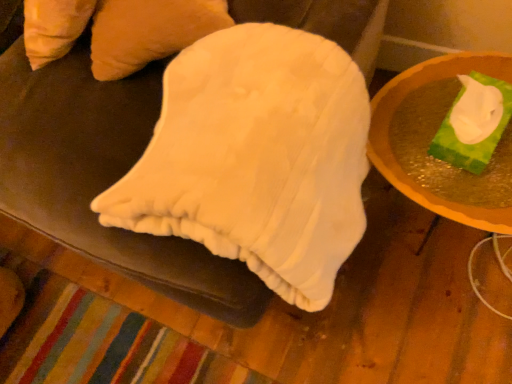
You are a GUI agent. You are given a task and a screenshot of the screen. Output one action in this format:
    pyautogui.click(x=<x>, y=<y>)
    Task: Click on the green matte tissue box at right
    This screenshot has height=384, width=512.
    Given the screenshot: What is the action you would take?
    pyautogui.click(x=394, y=112)

This screenshot has height=384, width=512. What do you see at coordinates (394, 112) in the screenshot?
I see `green matte tissue box at right` at bounding box center [394, 112].

Describe the element at coordinates (102, 177) in the screenshot. This screenshot has height=384, width=512. I see `matte white tissue box at right` at that location.

I want to click on matte white tissue box at right, so click(102, 177).

Locate an element on the screen. The height and width of the screenshot is (384, 512). green matte tissue box at right is located at coordinates [x=394, y=112].

Between matte white tissue box at right and green matte tissue box at right, which one appears on the right side from the viewer's perspective?

green matte tissue box at right is more to the right.

Is matte white tissue box at right further to camera compared to green matte tissue box at right?

That is False.

Which is behind, point (187, 304) or point (462, 220)?

Positioned behind is point (462, 220).

From the image's perspective, which one is positioned lower, matte white tissue box at right or green matte tissue box at right?

green matte tissue box at right.

From a real-world perspective, is matte white tissue box at right physically located above or below green matte tissue box at right?

From a real-world perspective, matte white tissue box at right is physically below green matte tissue box at right.

Which object is thinner, matte white tissue box at right or green matte tissue box at right?

Thinner between the two is green matte tissue box at right.

Between matte white tissue box at right and green matte tissue box at right, which one has less height?

Standing shorter between the two is green matte tissue box at right.

In the scene shown: Who is bigger, matte white tissue box at right or green matte tissue box at right?

matte white tissue box at right is bigger.

Is matte white tissue box at right inside or outside of green matte tissue box at right?

matte white tissue box at right is spatially situated outside green matte tissue box at right.

Does matte white tissue box at right touch green matte tissue box at right?

No, matte white tissue box at right is not next to green matte tissue box at right.

Is matte white tissue box at right looking in the opposite direction of green matte tissue box at right?

No, matte white tissue box at right is not facing the opposite direction of green matte tissue box at right.

How different are the orientations of matte white tissue box at right and green matte tissue box at right in degrees?

They differ by 4.82 degrees in their facing directions.

Where is `furniture that appears in front of the green matte tissue box at right`? furniture that appears in front of the green matte tissue box at right is located at coordinates (102, 177).

Which object is positioned more to the right, green matte tissue box at right or matte white tissue box at right?

From the viewer's perspective, green matte tissue box at right appears more on the right side.

Which object is further away from the camera taking this photo, green matte tissue box at right or matte white tissue box at right?

green matte tissue box at right is further away from the camera.

Which is more distant, (376, 123) or (32, 213)?

Positioned behind is point (376, 123).

From the image's perspective, does green matte tissue box at right appear lower than matte white tissue box at right?

Yes.

From a real-world perspective, is green matte tissue box at right on top of matte white tissue box at right?

Indeed, from a real-world perspective, green matte tissue box at right stands above matte white tissue box at right.

Which object is wider, green matte tissue box at right or matte white tissue box at right?

With larger width is matte white tissue box at right.

Considering the sizes of objects green matte tissue box at right and matte white tissue box at right in the image provided, who is taller, green matte tissue box at right or matte white tissue box at right?

matte white tissue box at right.

Can you confirm if green matte tissue box at right is bigger than matte white tissue box at right?

Actually, green matte tissue box at right might be smaller than matte white tissue box at right.

Is green matte tissue box at right located outside matte white tissue box at right?

Yes, green matte tissue box at right is located beyond the bounds of matte white tissue box at right.

In the scene shown: Can you see green matte tissue box at right touching matte white tissue box at right?

No.

Is green matte tissue box at right positioned with its back to matte white tissue box at right?

green matte tissue box at right is not turned away from matte white tissue box at right.

This screenshot has height=384, width=512. What are the coordinates of `furniture in front of the green matte tissue box at right` in the screenshot? It's located at coord(102,177).

Image resolution: width=512 pixels, height=384 pixels. In order to click on furniture below the green matte tissue box at right (from a real-world perspective) in this screenshot , I will do `click(102, 177)`.

Where is `furniture that appears above the green matte tissue box at right (from the image's perspective)`? furniture that appears above the green matte tissue box at right (from the image's perspective) is located at coordinates (102, 177).